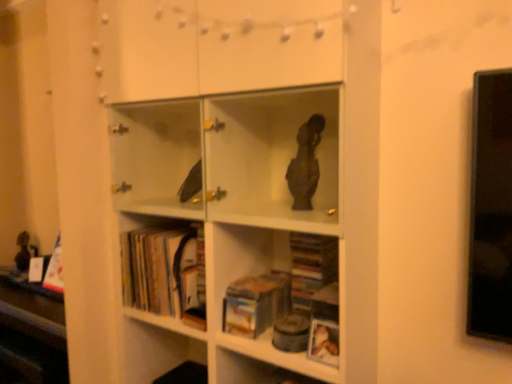
Question: Is white matte bookcase at center closer to the viewer compared to hardcover books at lower left, which is the 1th book in left-to-right order?

Choices:
 (A) yes
 (B) no

Answer: (A)

Question: From a real-world perspective, is white matte bookcase at center positioned under hardcover books at lower left, which is the 2th book in right-to-left order, based on gravity?

Choices:
 (A) no
 (B) yes

Answer: (A)

Question: Is white matte bookcase at center next to hardcover books at lower left, which is the 2th book in right-to-left order, and touching it?

Choices:
 (A) no
 (B) yes

Answer: (A)

Question: Is white matte bookcase at center at the left side of hardcover books at lower left, which is the 2th book in right-to-left order?

Choices:
 (A) yes
 (B) no

Answer: (B)

Question: From a real-world perspective, is white matte bookcase at center on hardcover books at lower left, which is the 2th book in right-to-left order?

Choices:
 (A) yes
 (B) no

Answer: (A)

Question: Is white matte bookcase at center completely or partially outside of hardcover books at lower left, which is the 2th book in right-to-left order?

Choices:
 (A) no
 (B) yes

Answer: (B)

Question: Considering the relative positions of hardcover book at center, positioned as the first book in right-to-left order, and hardcover books at lower left, which is the 1th book in left-to-right order, in the image provided, is hardcover book at center, positioned as the first book in right-to-left order, in front of hardcover books at lower left, which is the 1th book in left-to-right order,?

Choices:
 (A) yes
 (B) no

Answer: (A)

Question: Is hardcover book at center, which ranks as the second book in left-to-right order, not inside hardcover books at lower left, which is the 2th book in right-to-left order?

Choices:
 (A) no
 (B) yes

Answer: (B)

Question: Is hardcover book at center, positioned as the first book in right-to-left order, oriented towards hardcover books at lower left, which is the 2th book in right-to-left order?

Choices:
 (A) no
 (B) yes

Answer: (A)

Question: Is hardcover book at center, which ranks as the second book in left-to-right order, taller than hardcover books at lower left, which is the 1th book in left-to-right order?

Choices:
 (A) no
 (B) yes

Answer: (A)

Question: Does hardcover book at center, positioned as the first book in right-to-left order, appear on the left side of hardcover books at lower left, which is the 2th book in right-to-left order?

Choices:
 (A) no
 (B) yes

Answer: (A)

Question: Does hardcover book at center, which ranks as the second book in left-to-right order, have a lesser height compared to hardcover books at lower left, which is the 2th book in right-to-left order?

Choices:
 (A) yes
 (B) no

Answer: (A)

Question: Does white matte bookcase at center have a greater width compared to hardcover book at center, which ranks as the second book in left-to-right order?

Choices:
 (A) no
 (B) yes

Answer: (B)